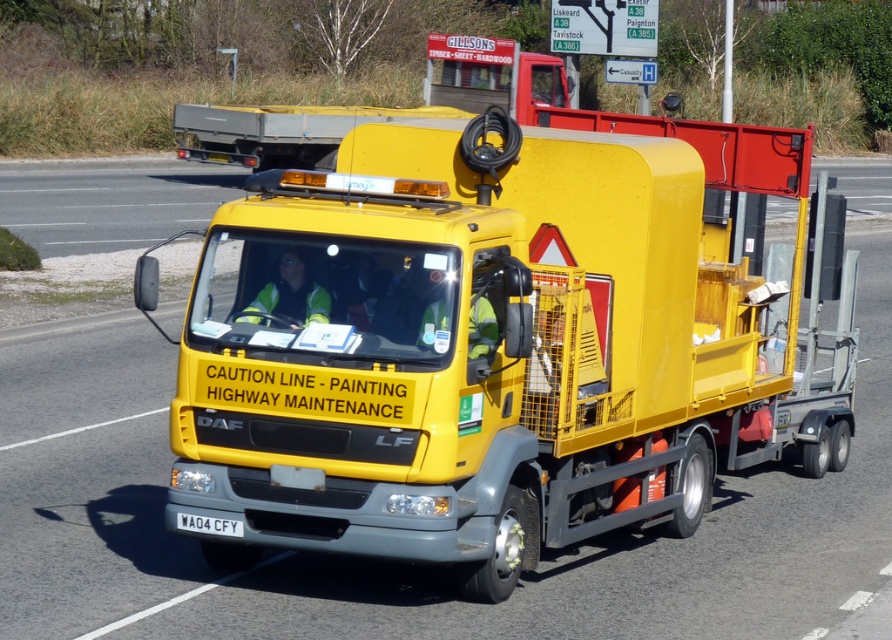
Question: Is yellow matte truck at center bigger than white plastic license plate at center?

Choices:
 (A) no
 (B) yes

Answer: (B)

Question: Which point is closer to the camera?

Choices:
 (A) (213, 525)
 (B) (482, 225)

Answer: (A)

Question: Does yellow matte truck at center have a larger size compared to white plastic license plate at center?

Choices:
 (A) no
 (B) yes

Answer: (B)

Question: Which point appears farthest from the camera in this image?

Choices:
 (A) (750, 289)
 (B) (241, 532)

Answer: (A)

Question: Which object appears farthest from the camera in this image?

Choices:
 (A) white plastic license plate at center
 (B) yellow matte truck at center

Answer: (B)

Question: Does yellow matte truck at center come in front of white plastic license plate at center?

Choices:
 (A) no
 (B) yes

Answer: (A)